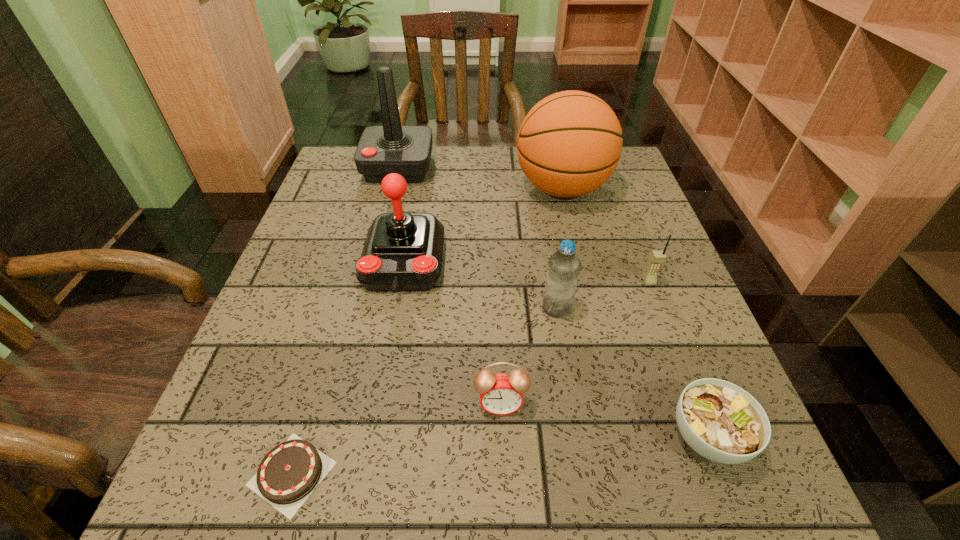
Find the location of a particular element. vacant space located 0.150m on the front of the taller joystick is located at coordinates (385, 222).

At what (x,y) coordinates should I click in order to perform the action: click on blank space located 0.230m on the left of the basketball. Please return your answer as a coordinate pair (x, y). Image resolution: width=960 pixels, height=540 pixels. Looking at the image, I should click on (426, 189).

Locate an element on the screen. The height and width of the screenshot is (540, 960). free space located 0.050m on the base of the sixth shortest object is located at coordinates (393, 324).

Locate an element on the screen. free space located on the right of the fifth shortest object is located at coordinates (623, 308).

At what (x,y) coordinates should I click in order to perform the action: click on vacant area situated on the front of the fourth shortest object, where the keypad is located. Please return your answer as a coordinate pair (x, y). The height and width of the screenshot is (540, 960). Looking at the image, I should click on (723, 476).

You are a GUI agent. You are given a task and a screenshot of the screen. Output one action in this format:
    pyautogui.click(x=<x>, y=<y>)
    Task: Click on the vacant area located on the clock face of the alarm clock
    The image size is (960, 540).
    Given the screenshot: What is the action you would take?
    pyautogui.click(x=502, y=454)

Locate an element on the screen. Image resolution: width=960 pixels, height=540 pixels. vacant space located 0.080m on the left of the soup bowl is located at coordinates (616, 437).

The height and width of the screenshot is (540, 960). In order to click on free location located 0.310m on the right of the shortest object in this screenshot , I will do `click(549, 474)`.

Find the location of a particular element. This screenshot has width=960, height=540. joystick at the far edge is located at coordinates (406, 150).

Where is `basketball that is at the far edge`? basketball that is at the far edge is located at coordinates (569, 144).